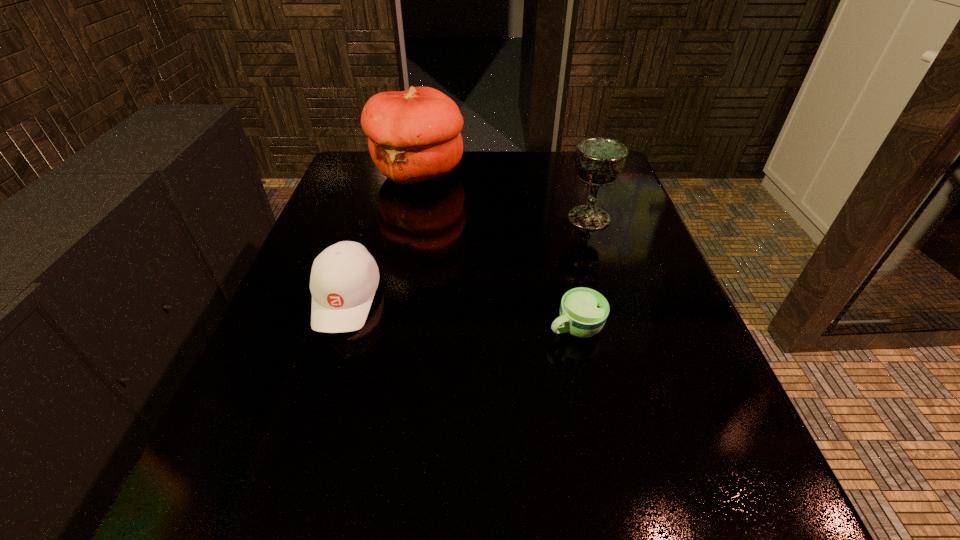
Locate an element on the screen. vacant region between the pumpkin and the baseball cap is located at coordinates (382, 235).

At what (x,y) coordinates should I click in order to perform the action: click on vacant space in between the chalice and the cup. Please return your answer as a coordinate pair (x, y). Looking at the image, I should click on (582, 273).

Point out which object is positioned as the second nearest to the chalice. Please provide its 2D coordinates. Your answer should be formatted as a tuple, i.e. [(x, y)], where the tuple contains the x and y coordinates of a point satisfying the conditions above.

[(583, 311)]

Identify the location of object identified as the second closest to the baseball cap. The height and width of the screenshot is (540, 960). [583, 311].

The width and height of the screenshot is (960, 540). I want to click on vacant point that satisfies the following two spatial constraints: 1. on the front side of the cup; 2. on the right side of the farthest object, so click(x=385, y=328).